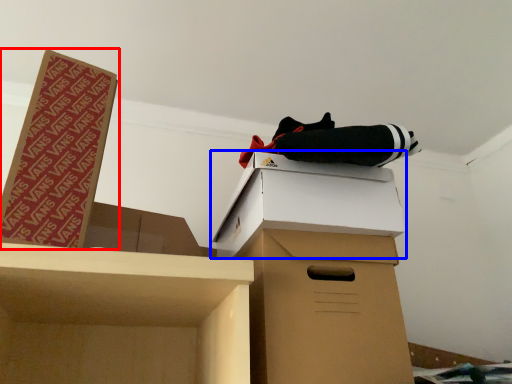
Question: Among these objects, which one is farthest to the camera, box (highlighted by a red box) or box (highlighted by a blue box)?

Choices:
 (A) box
 (B) box

Answer: (B)